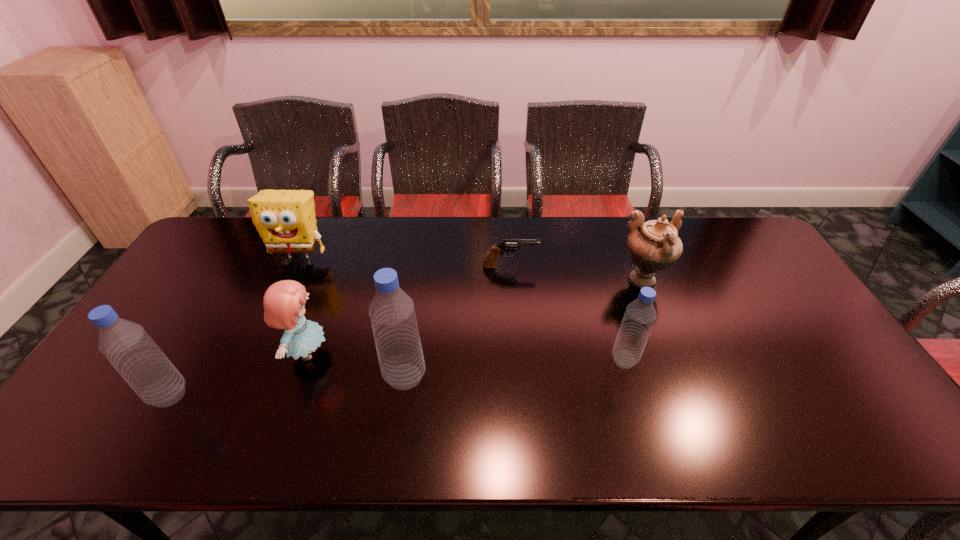
You are a GUI agent. You are given a task and a screenshot of the screen. Output one action in this format:
    pyautogui.click(x=<x>, y=<y>)
    Task: Click on the free space for a new bottle on the right
    This screenshot has width=960, height=540.
    Given the screenshot: What is the action you would take?
    click(830, 343)